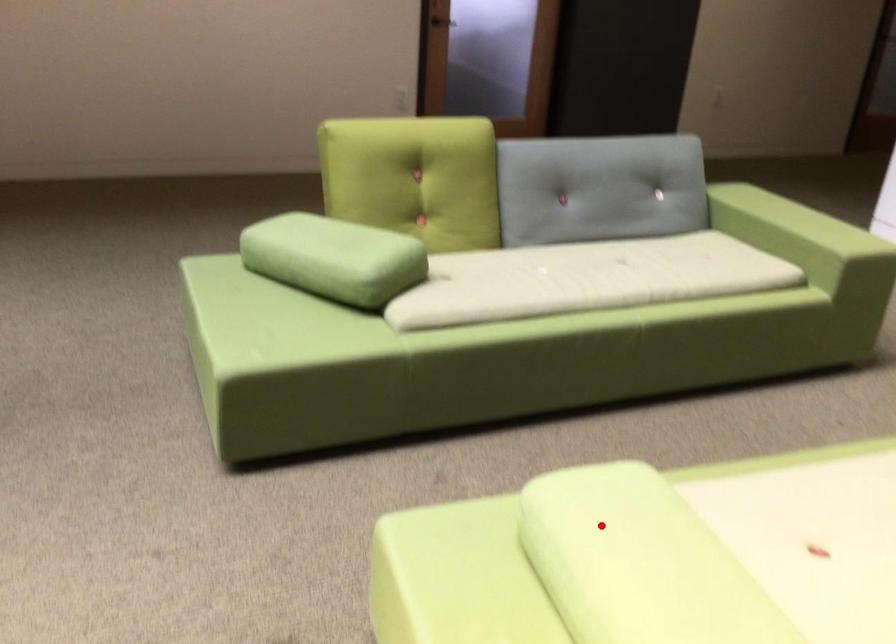
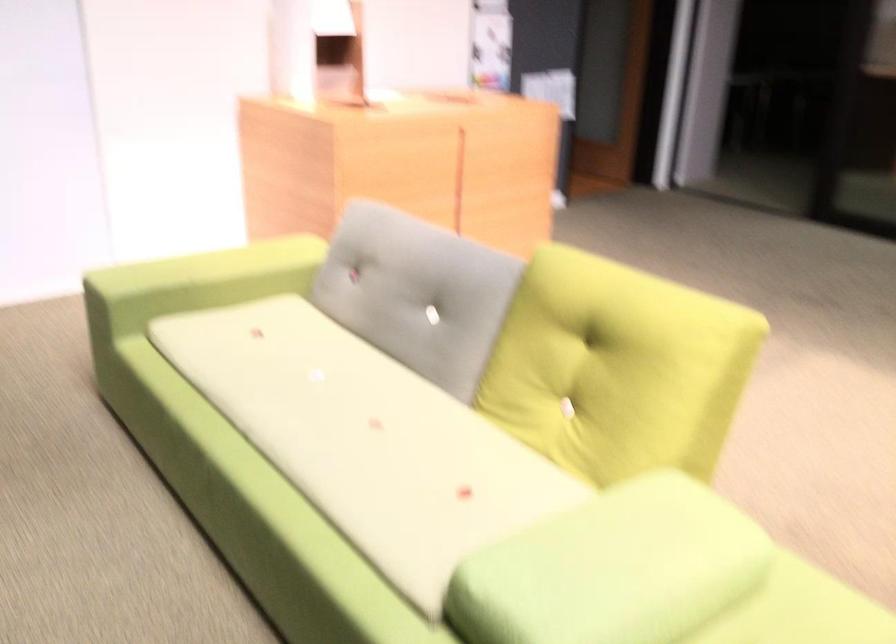
The point at the highlighted location is marked in the first image. Where is the corresponding point in the second image?

(613, 569)